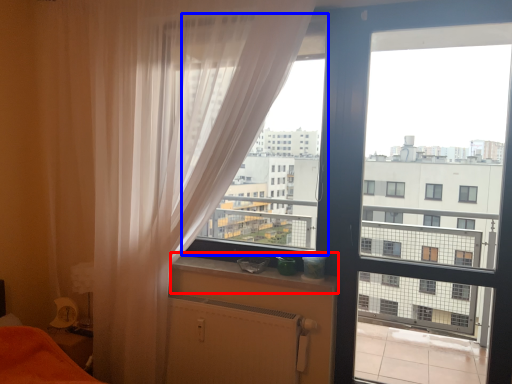
Question: Which of the following is the farthest to the observer, window sill (highlighted by a red box) or window screen (highlighted by a blue box)?

Choices:
 (A) window sill
 (B) window screen

Answer: (B)